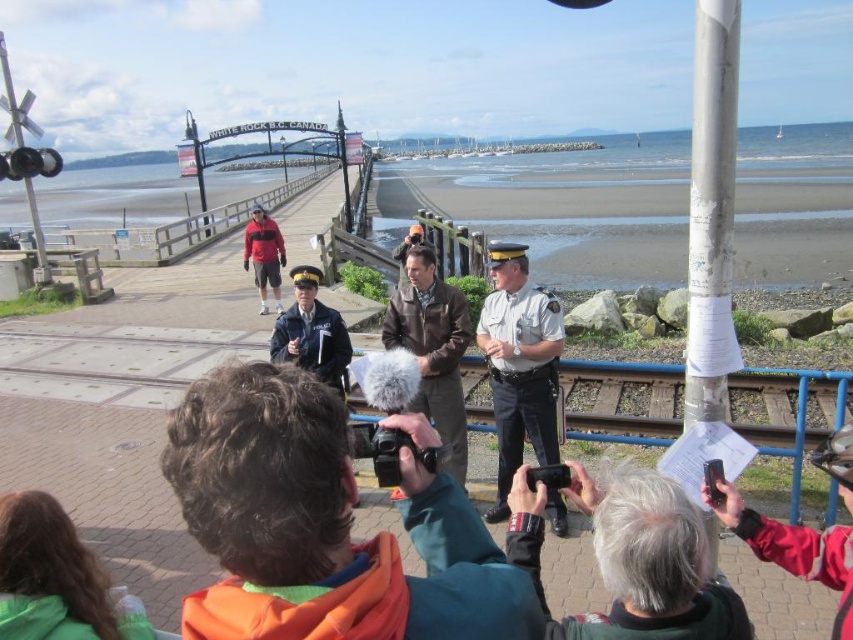
You are standing at the origin point of the coordinate system in the image. You want to move towards the orange fleece jacket at center. In which direction should you move?

The orange fleece jacket at center is located at coordinate point 0.822 on the x axis and 0.380 on the y axis. Since the origin point is at the bottom left corner of the image, you should move towards the right and slightly upward to reach the orange fleece jacket at center.

You are a tourist visiting White Rock, B.C., Canada. You see the red matte jacket at lower right and the uniformed officer at center. Which object is positioned more to the right side of the scene?

The red matte jacket at lower right is positioned more to the right side of the scene than the uniformed officer at center.